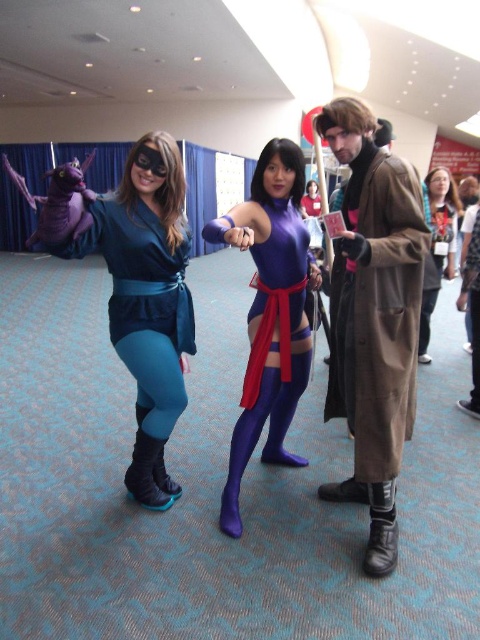
Does matte blue jumpsuit at center have a greater height compared to shiny purple bodysuit at center?

No, matte blue jumpsuit at center is not taller than shiny purple bodysuit at center.

Is point (95, 221) farther from viewer compared to point (238, 212)?

No, it is in front of (238, 212).

Locate an element on the screen. This screenshot has height=640, width=480. matte blue jumpsuit at center is located at coordinates (139, 291).

Find the location of a particular element. The image size is (480, 640). matte blue jumpsuit at center is located at coordinates (139, 291).

Can you confirm if matte blue jumpsuit at center is wider than matte purple dress at center?

Incorrect, matte blue jumpsuit at center's width does not surpass matte purple dress at center's.

Can you confirm if matte blue jumpsuit at center is positioned to the left of matte purple dress at center?

Yes, matte blue jumpsuit at center is to the left of matte purple dress at center.

Image resolution: width=480 pixels, height=640 pixels. Find the location of `matte blue jumpsuit at center`. matte blue jumpsuit at center is located at coordinates (139, 291).

Can you confirm if shiny purple bodysuit at center is positioned above matte purple dress at center?

No.

Is shiny purple bodysuit at center to the left of matte purple dress at center from the viewer's perspective?

Correct, you'll find shiny purple bodysuit at center to the left of matte purple dress at center.

Between point (280, 182) and point (437, 225), which one is positioned behind?

The point (437, 225) is more distant.

The height and width of the screenshot is (640, 480). Identify the location of shiny purple bodysuit at center. (269, 312).